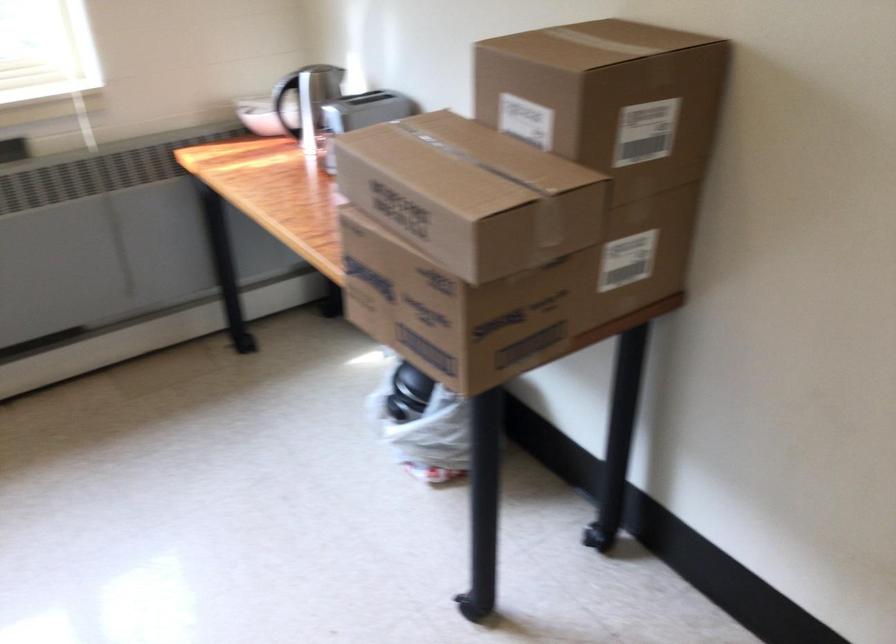
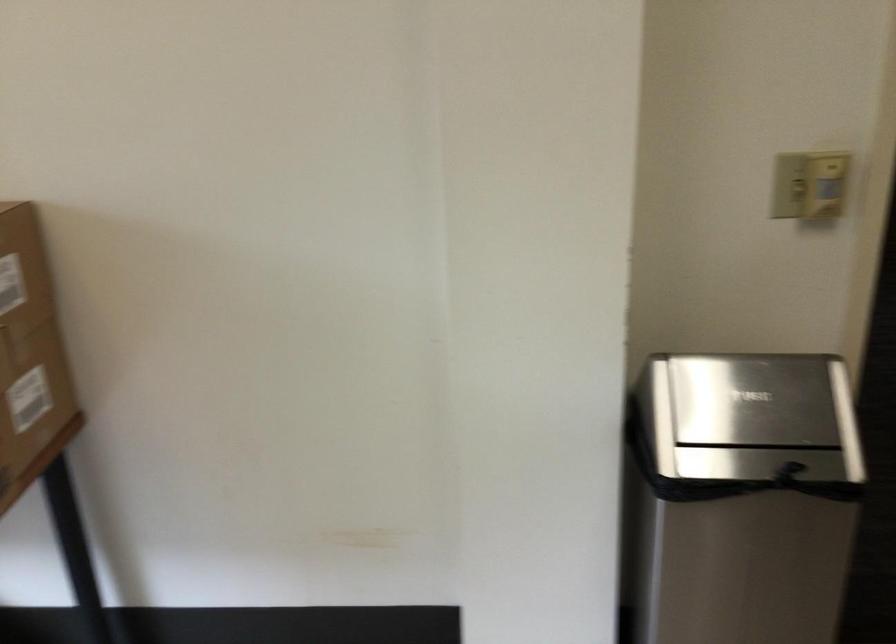
Question: The camera is either moving clockwise (left) or counter-clockwise (right) around the object. The first image is from the beginning of the video and the second image is from the end. Is the camera moving left or right when shooting the video?

Choices:
 (A) Left
 (B) Right

Answer: (A)